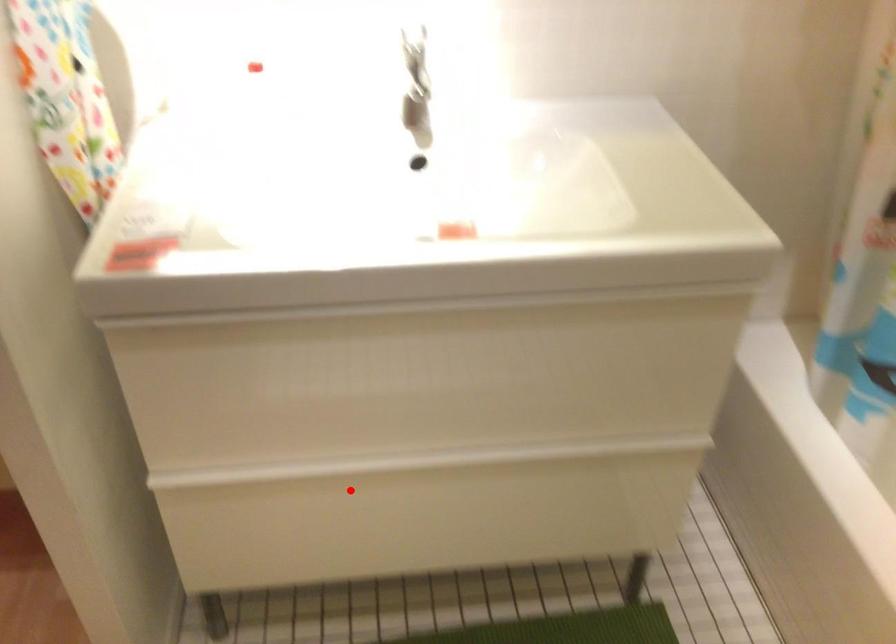
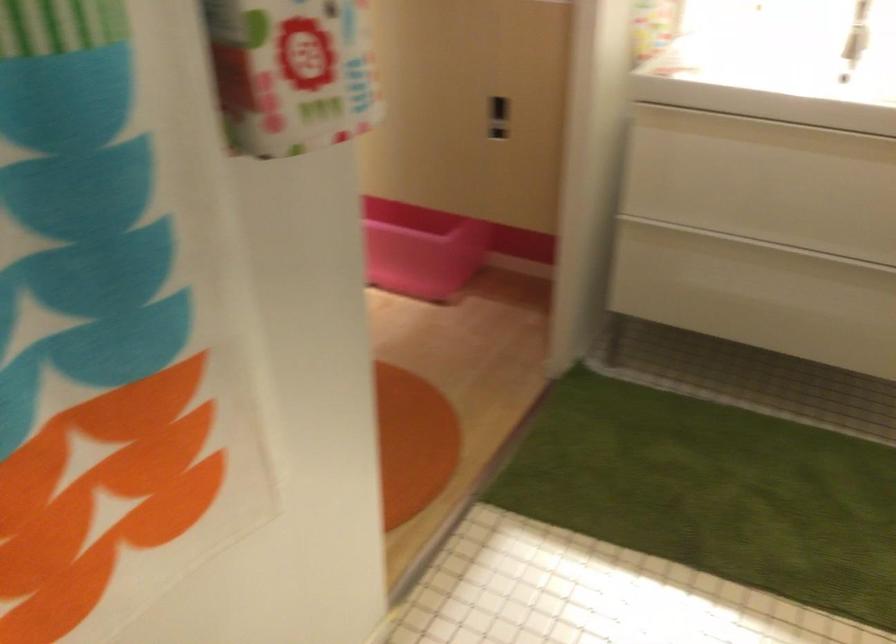
Question: I am providing you with two images of the same scene from different viewpoints. In image1, a red point is highlighted. Considering the same 3D point in image2, which of the following is correct?

Choices:
 (A) It is closer
 (B) It is farther

Answer: (B)